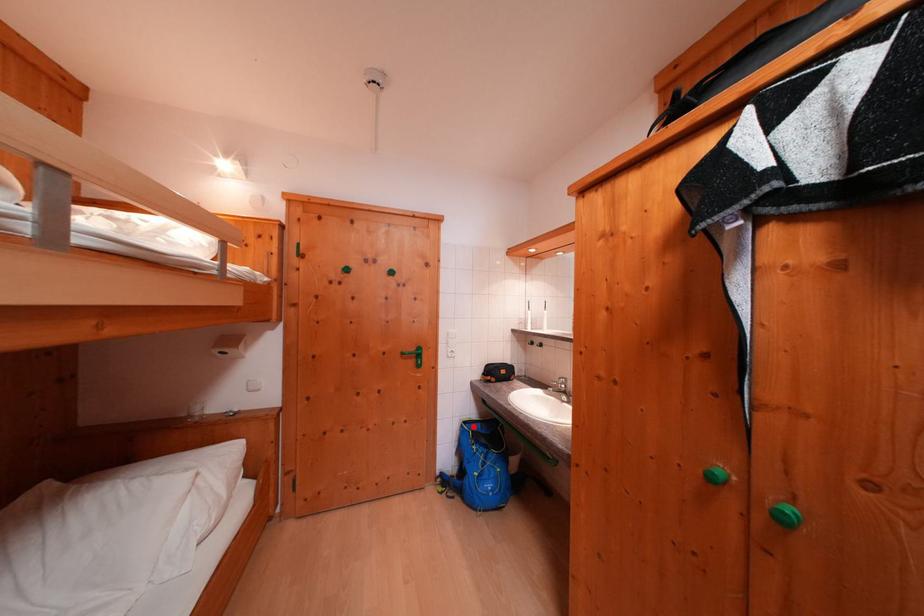
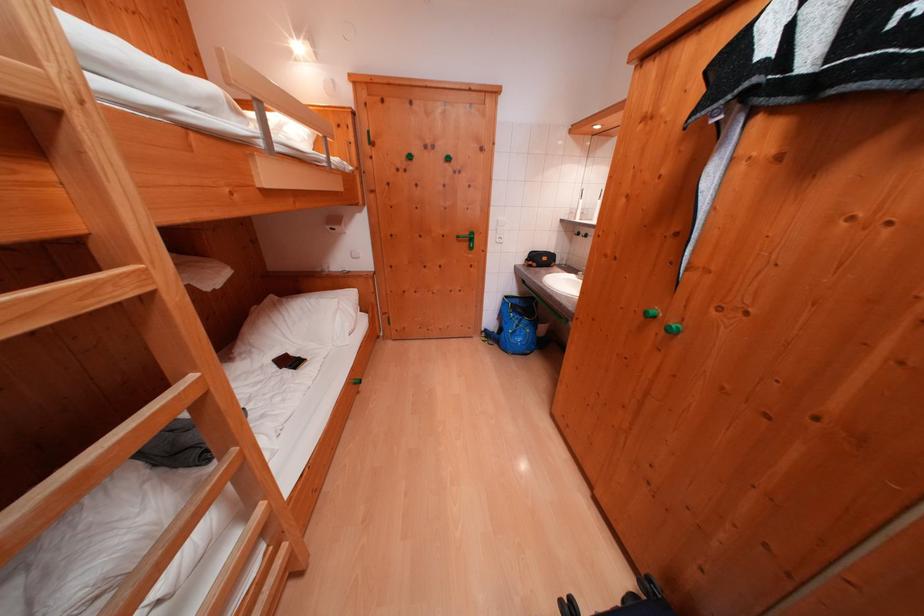
Question: I am providing you with two images of the same scene from different viewpoints. A red point is marked on the first image. At the location where the point appears in image 1, is it still visible in image 2?

Choices:
 (A) Yes
 (B) No

Answer: (A)